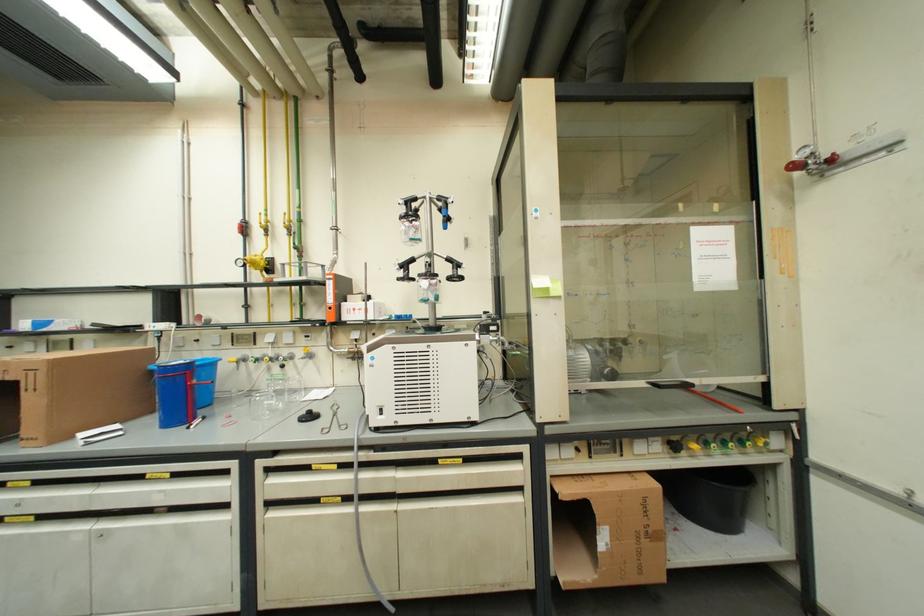
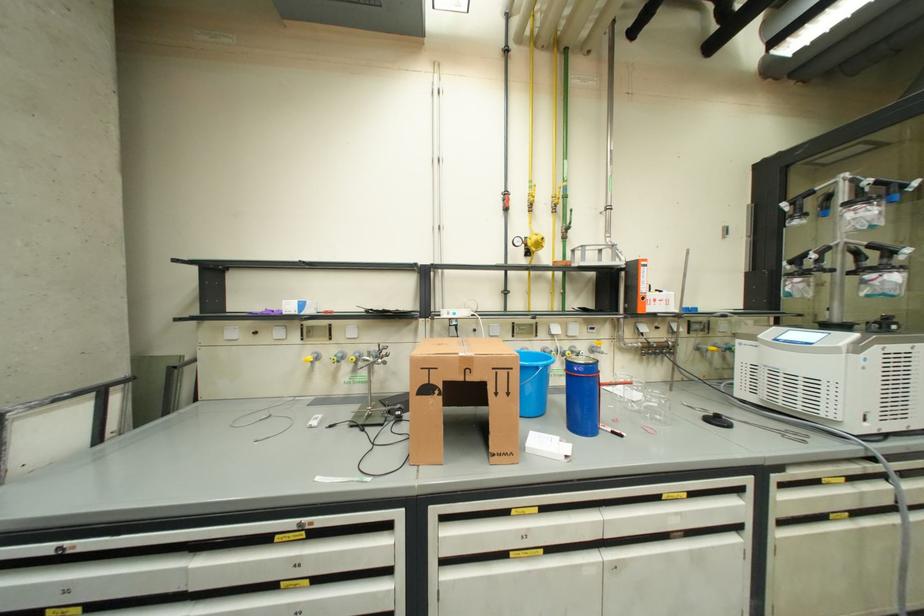
Question: The images are taken continuously from a first-person perspective. In which direction are you moving?

Choices:
 (A) Left
 (B) Right
 (C) Forward
 (D) Backward

Answer: (A)